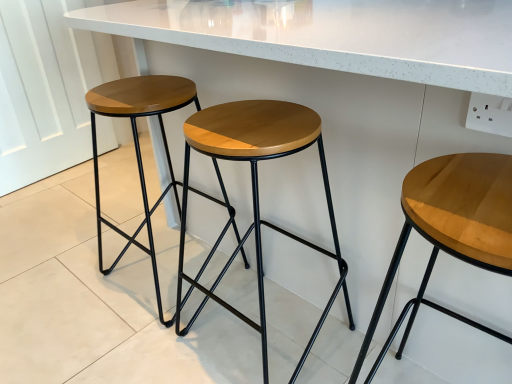
The image size is (512, 384). What are the coordinates of `vacant area in front of wooden seat at center, placed as the 3th stool when sorted from right to left` in the screenshot? It's located at (129, 346).